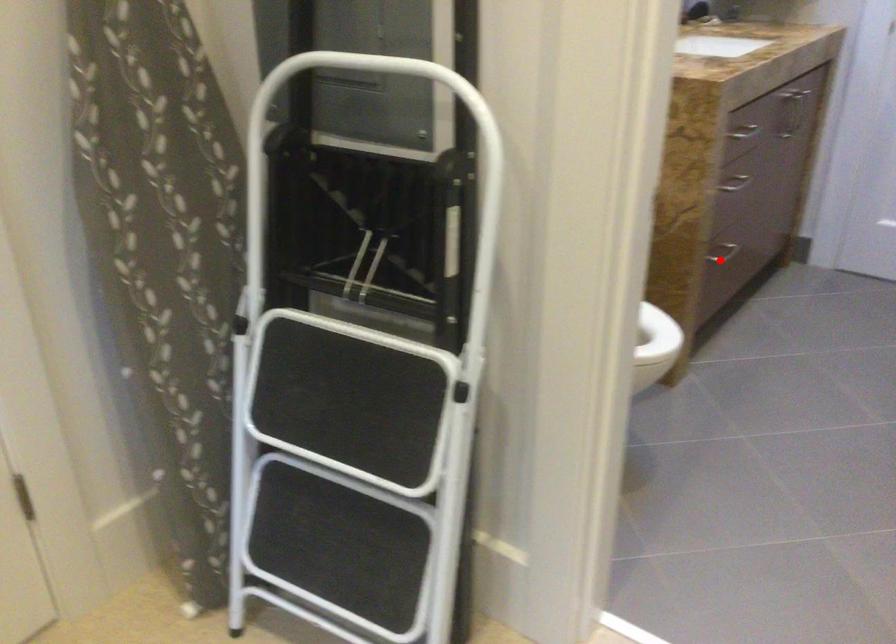
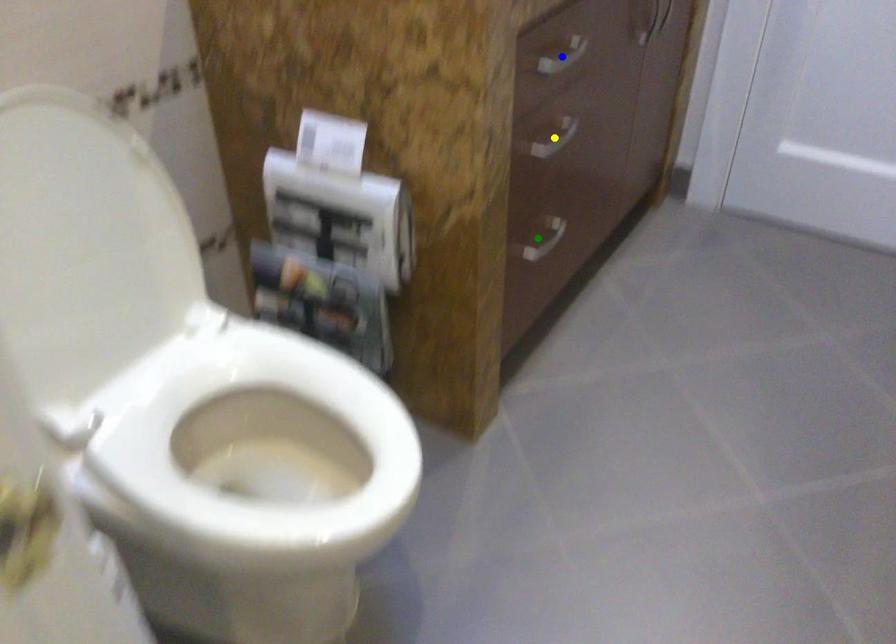
Question: I am providing you with two images of the same scene from different viewpoints. A red point is marked on the first image. You are given multiple points on the second image. Which point in image 2 represents the same 3d spot as the red point in image 1?

Choices:
 (A) yellow point
 (B) blue point
 (C) green point

Answer: (C)